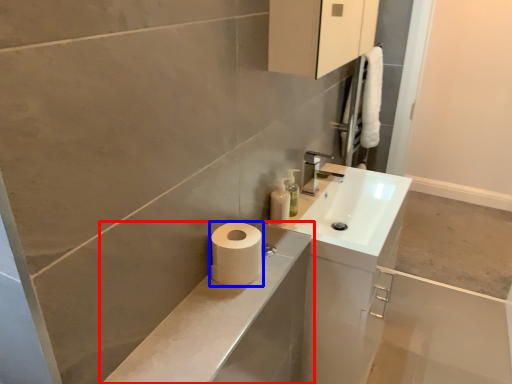
Question: Which point is further to the camera, bathroom cabinet (highlighted by a red box) or toilet paper (highlighted by a blue box)?

Choices:
 (A) bathroom cabinet
 (B) toilet paper

Answer: (B)